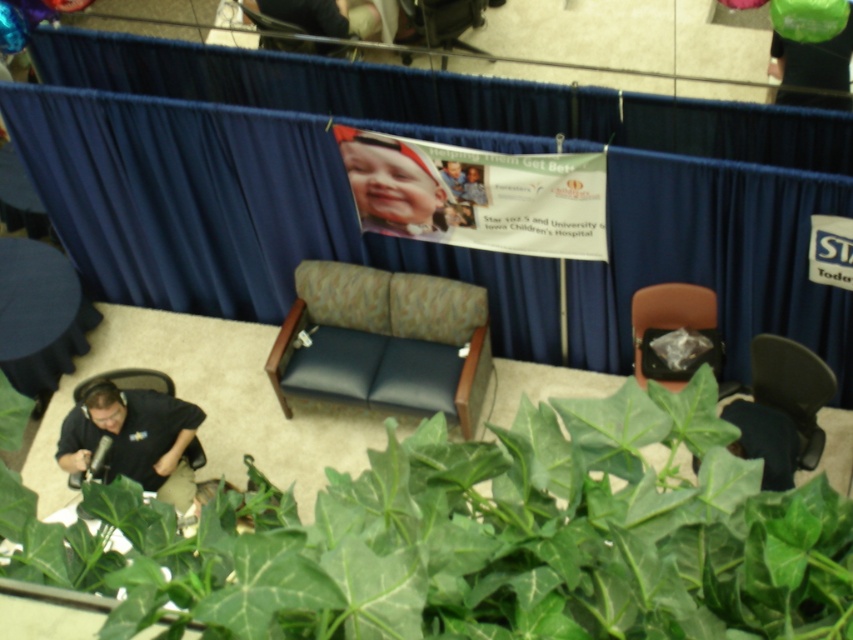
Looking at this image, between blue fabric curtain at upper center and smooth plastic banner at upper center, which one is positioned higher?

smooth plastic banner at upper center is higher up.

Is blue fabric curtain at upper center thinner than smooth plastic banner at upper center?

In fact, blue fabric curtain at upper center might be wider than smooth plastic banner at upper center.

Does point (769, 205) come behind point (432, 193)?

That is False.

I want to click on blue fabric curtain at upper center, so tap(253, 172).

Between blue fabric curtain at upper center and smooth skin baby at upper center, which one appears on the left side from the viewer's perspective?

From the viewer's perspective, blue fabric curtain at upper center appears more on the left side.

What do you see at coordinates (253, 172) in the screenshot?
I see `blue fabric curtain at upper center` at bounding box center [253, 172].

You are a GUI agent. You are given a task and a screenshot of the screen. Output one action in this format:
    pyautogui.click(x=<x>, y=<y>)
    Task: Click on the blue fabric curtain at upper center
    The width and height of the screenshot is (853, 640).
    Given the screenshot: What is the action you would take?
    pyautogui.click(x=253, y=172)

In the scene shown: Who is lower down, smooth plastic banner at upper center or matte black bag at right?

matte black bag at right

Can you confirm if smooth plastic banner at upper center is thinner than matte black bag at right?

Incorrect, smooth plastic banner at upper center's width is not less than matte black bag at right's.

Is point (341, 156) in front of point (699, 298)?

Yes, point (341, 156) is closer to viewer.

Where is `smooth plastic banner at upper center`? smooth plastic banner at upper center is located at coordinates (390, 186).